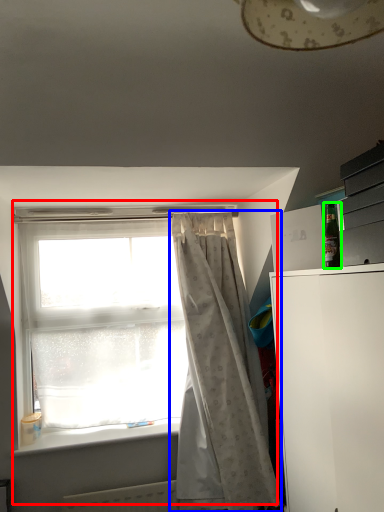
Question: Which is nearer to the window (highlighted by a red box)? curtain (highlighted by a blue box) or bottle (highlighted by a green box).

Choices:
 (A) curtain
 (B) bottle

Answer: (A)